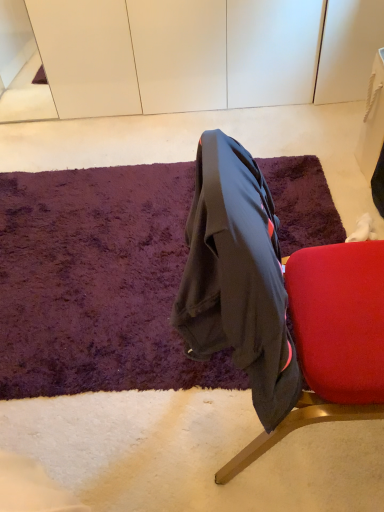
Measure the distance between point (9, 232) and camera.

The distance of point (9, 232) from camera is 6.01 feet.

Image resolution: width=384 pixels, height=512 pixels. Describe the element at coordinates (96, 282) in the screenshot. I see `purple shaggy rug at center` at that location.

The image size is (384, 512). I want to click on purple shaggy rug at center, so click(x=96, y=282).

Consider the image. Measure the distance between purple shaggy rug at center and camera.

They are 4.13 feet apart.

Identify the location of purple shaggy rug at center. (96, 282).